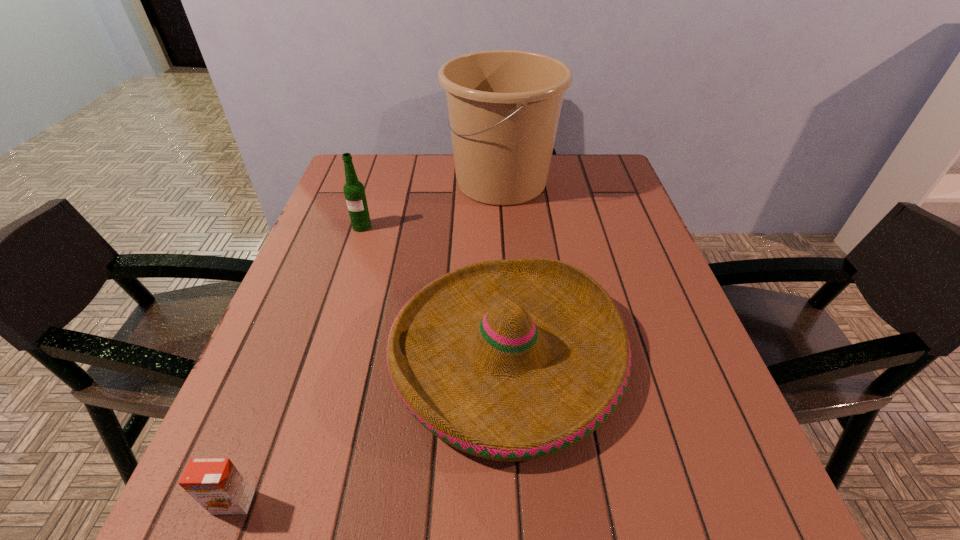
This screenshot has width=960, height=540. In order to click on bucket in this screenshot , I will do `click(504, 106)`.

Locate an element on the screen. The image size is (960, 540). the tallest object is located at coordinates (504, 106).

Where is `the third nearest object`? The height and width of the screenshot is (540, 960). the third nearest object is located at coordinates click(x=354, y=191).

This screenshot has height=540, width=960. I want to click on beer bottle, so click(x=354, y=191).

Identify the location of sombrero. (511, 360).

This screenshot has width=960, height=540. What are the coordinates of `the third tallest object` in the screenshot? It's located at (511, 360).

The height and width of the screenshot is (540, 960). I want to click on the nearest object, so click(216, 484).

Identify the location of orange juice. The width and height of the screenshot is (960, 540). (216, 484).

This screenshot has height=540, width=960. In order to click on blank area located 0.150m on the right of the farthest object in this screenshot , I will do pos(610,183).

Find the location of `free space located on the label of the third shortest object`. free space located on the label of the third shortest object is located at coordinates (324, 346).